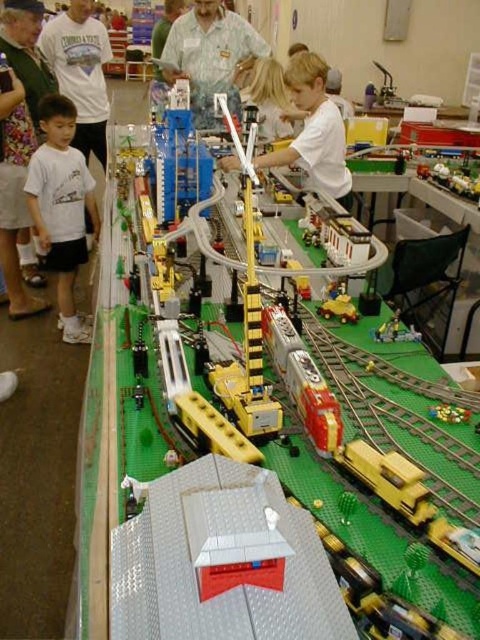
Is light blue shirt at center positioned behind white matte boy at center?

Yes, it is.

Between point (197, 81) and point (308, 134), which one is positioned in front?

Point (308, 134) is in front.

At what (x,y) coordinates should I click in order to perform the action: click on light blue shirt at center. Please return your answer as a coordinate pair (x, y). This screenshot has height=640, width=480. Looking at the image, I should click on (211, 56).

Does white matte shirt at left have a larger size compared to yellow plastic train at center?

Yes, white matte shirt at left is bigger than yellow plastic train at center.

Who is more forward, (25, 186) or (405, 333)?

Positioned in front is point (405, 333).

Identify the location of white matte shirt at left. (61, 208).

Does white matte shirt at left have a larger size compared to white matte boy at center?

No, white matte shirt at left is not bigger than white matte boy at center.

Who is lower down, white matte shirt at left or white matte boy at center?

white matte shirt at left is lower down.

The image size is (480, 640). What do you see at coordinates (61, 208) in the screenshot?
I see `white matte shirt at left` at bounding box center [61, 208].

Locate an element on the screen. The width and height of the screenshot is (480, 640). white matte shirt at left is located at coordinates (61, 208).